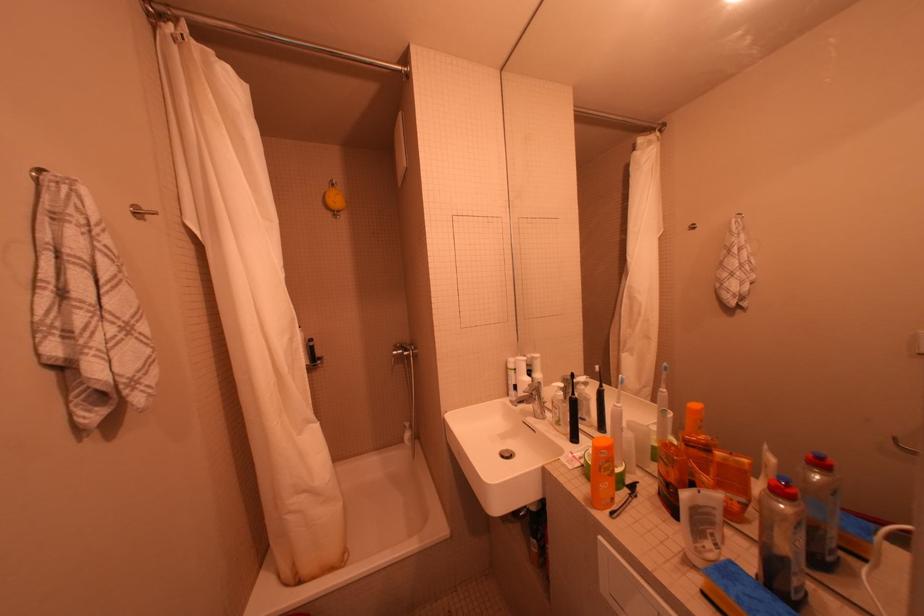
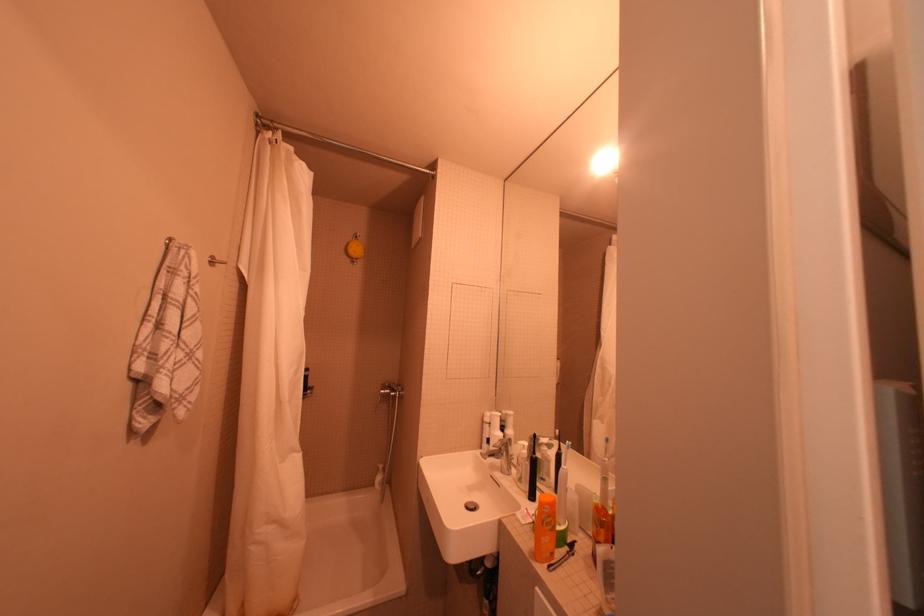
Where in the second image is the point corresponding to the point at 667,504 from the first image?

(600, 564)